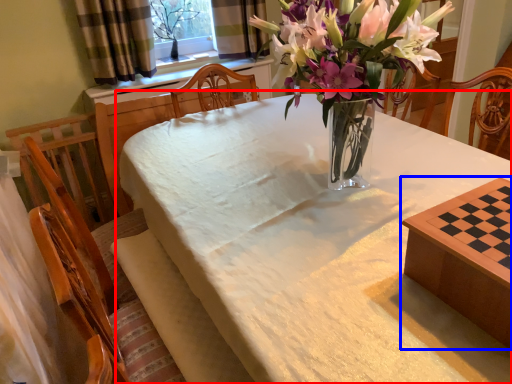
Question: Among these objects, which one is nearest to the camera, table (highlighted by a red box) or table (highlighted by a blue box)?

Choices:
 (A) table
 (B) table

Answer: (A)